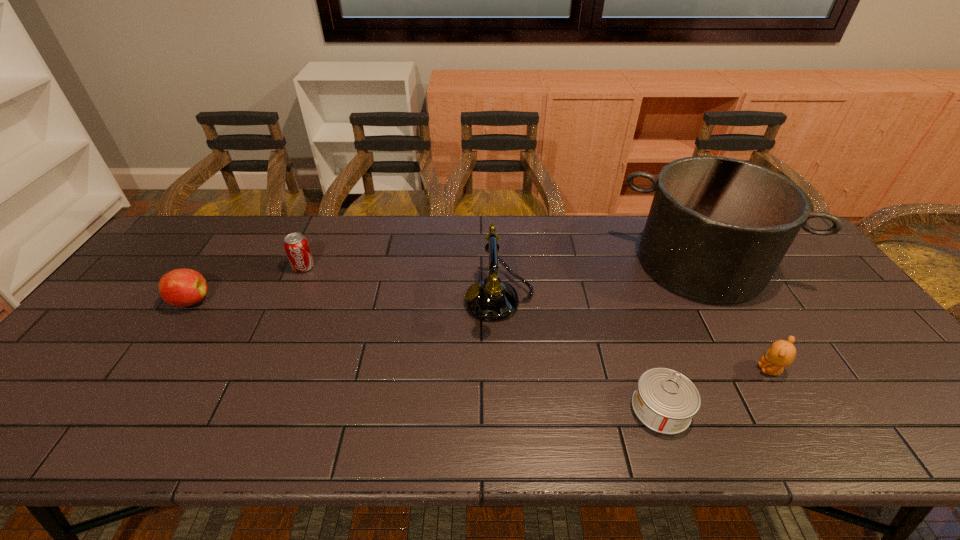
You are a GUI agent. You are given a task and a screenshot of the screen. Output one action in this format:
    pyautogui.click(x=<x>, y=<y>)
    Task: Click on the object present at the left edge
    The width and height of the screenshot is (960, 540).
    Given the screenshot: What is the action you would take?
    pyautogui.click(x=181, y=287)

At what (x,y) coordinates should I click in order to perform the action: click on object present at the right edge. Please return your answer as a coordinate pair (x, y). The image size is (960, 540). Looking at the image, I should click on (718, 228).

Image resolution: width=960 pixels, height=540 pixels. Identify the location of object located in the far right corner section of the desktop. (718, 228).

Identify the location of free space at the far edge of the desktop. This screenshot has height=540, width=960. (431, 233).

The height and width of the screenshot is (540, 960). I want to click on vacant space at the near edge, so click(x=804, y=422).

This screenshot has height=540, width=960. Identify the location of blank space at the right edge. (856, 322).

Locate an element on the screen. This screenshot has width=960, height=540. vacant space at the far left corner of the desktop is located at coordinates (172, 248).

Find the location of a particular element. This screenshot has width=960, height=540. free area in between the can and the pan is located at coordinates (681, 336).

Identify the location of free spot between the teddy bear and the soda. (537, 319).

Locate an element on the screen. Image resolution: width=960 pixels, height=540 pixels. vacant area that lies between the apple and the nearest object is located at coordinates (425, 355).